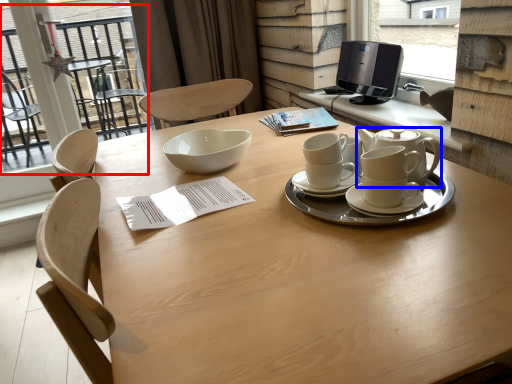
Question: Which point is further to the camera, glass door (highlighted by a red box) or teapot (highlighted by a blue box)?

Choices:
 (A) glass door
 (B) teapot

Answer: (A)